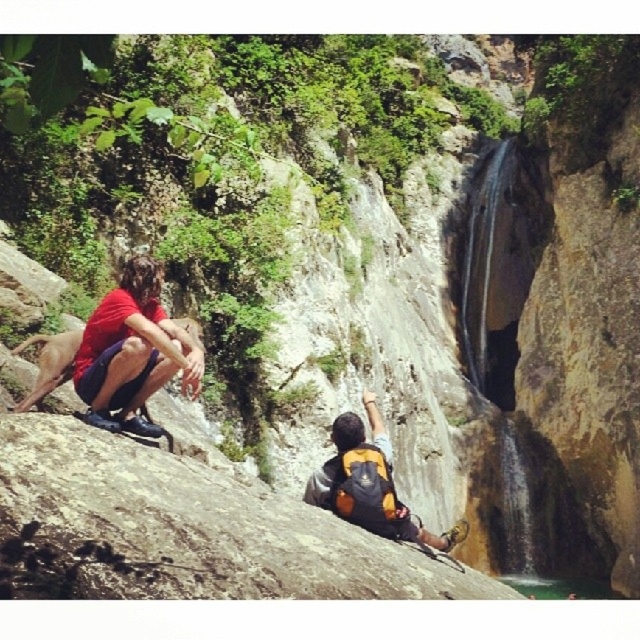
Locate an element on the screen. matte red shirt at left is located at coordinates (131, 352).

Which is behind, point (115, 356) or point (330, 467)?

The point (330, 467) is more distant.

Is point (182, 355) positioned behind point (372, 488)?

Yes, it is.

Where is `matte red shirt at left`? This screenshot has width=640, height=640. matte red shirt at left is located at coordinates (131, 352).